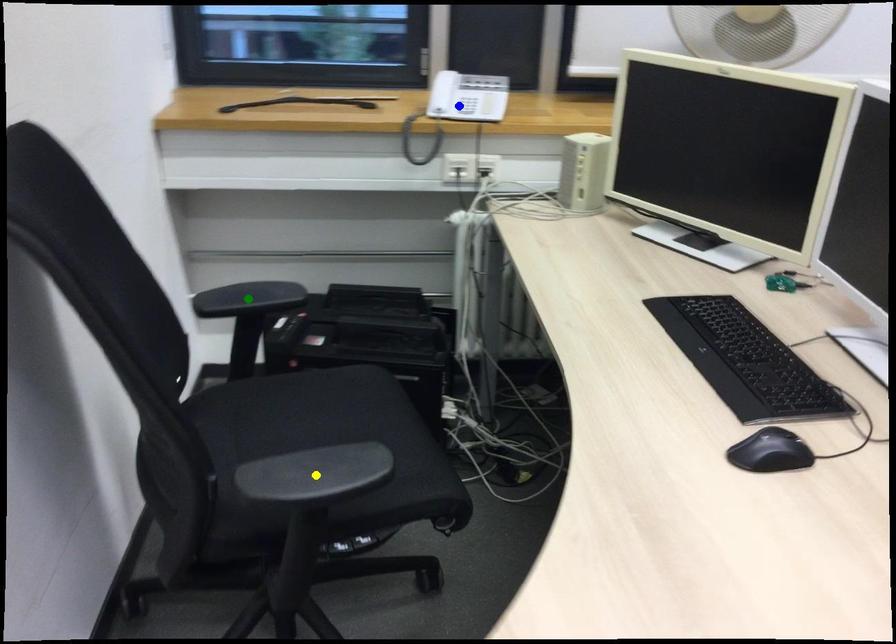
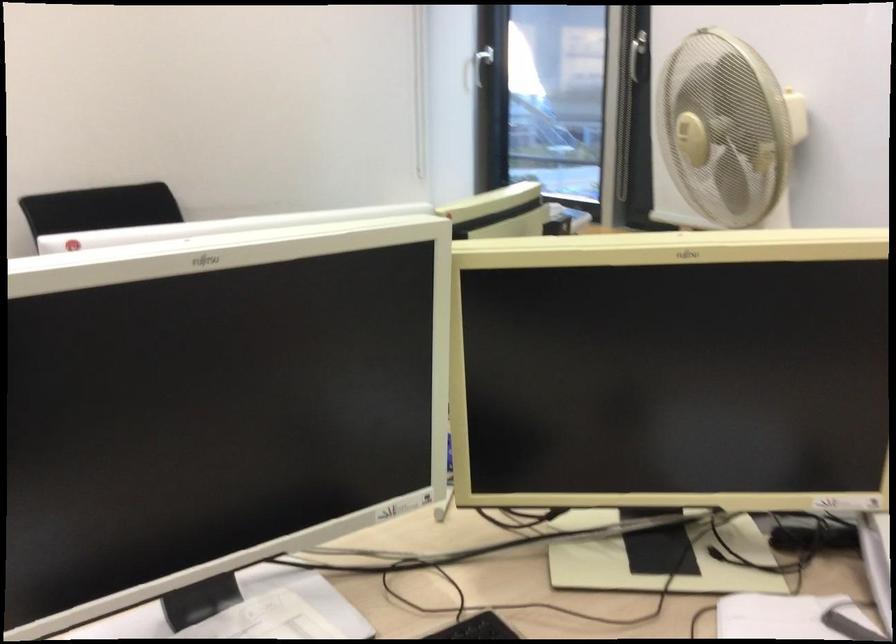
I am providing you with two images of the same scene from different viewpoints. Three points are marked in image1. Which point corresponds to a part or object that is occluded in image2?In image1, three points are marked. Which of them correspond to a part or object that is occluded in image2?Among the three points shown in image1, which one corresponds to a part or object that is no longer visible due to occlusion in image2?

Invisible in image2: yellow point, blue point, green point.